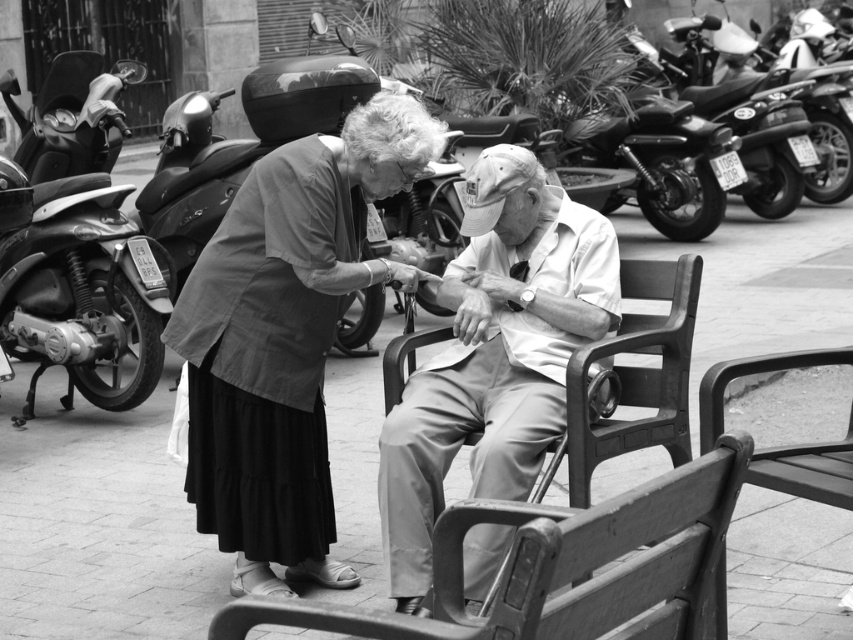
You are a photographer trying to capture a closeup of the light brown wooden bench at center and the smooth beige pants at center in the scene. Given that your camera can only focus on objects within 0.5 inches of each other, will you be able to get a clear photo of both subjects?

The light brown wooden bench at center is 0.65 inches away from the smooth beige pants at center, which is beyond the camera focus range of 0.5 inches. Therefore, you cannot get a clear photo of both subjects.

You are a photographer analyzing the composition of this black and white photo. You notice the smooth beige pants at center and the shiny black motorcycle at left. Which object appears taller in the image?

The smooth beige pants at center appears taller than the shiny black motorcycle at left in the image.